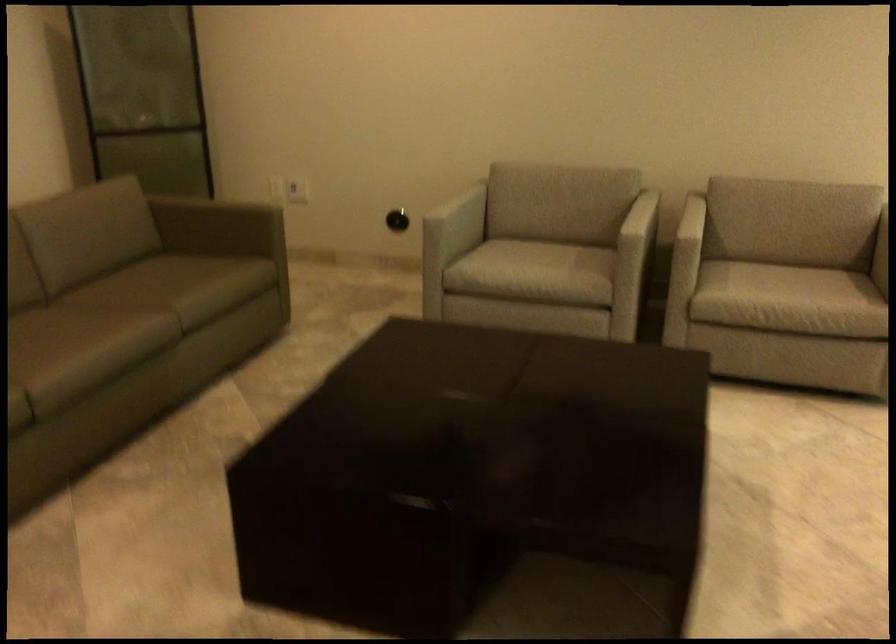
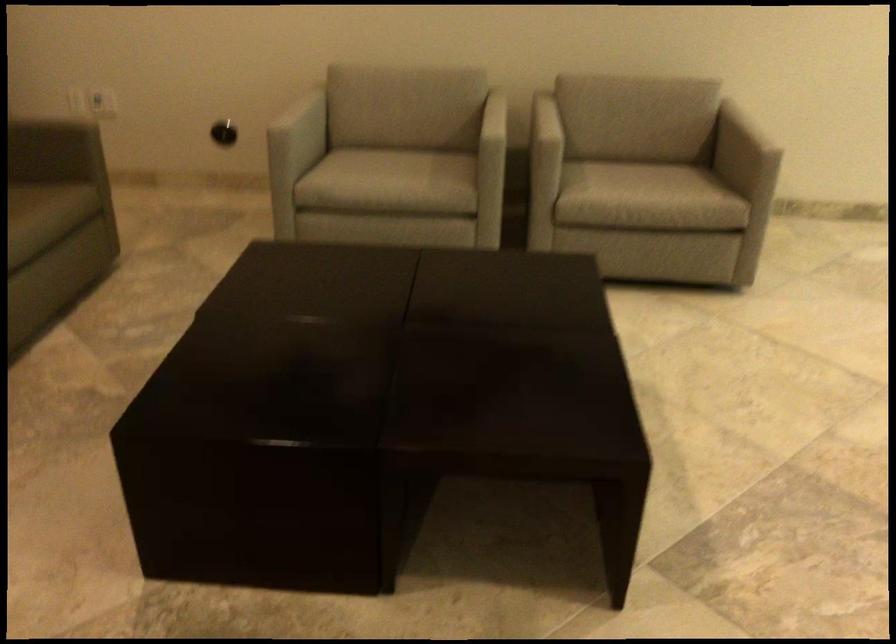
Where in the second image is the point corresponding to (220,283) from the first image?

(36, 219)